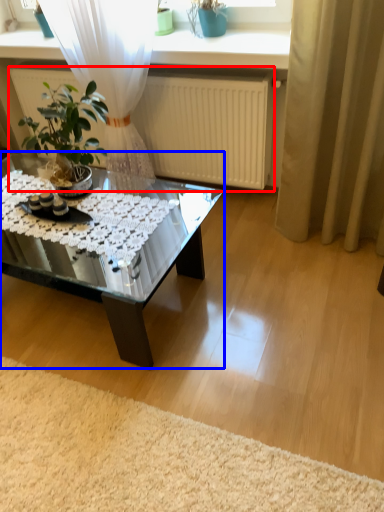
Question: Among these objects, which one is nearest to the camera, radiator (highlighted by a red box) or coffee table (highlighted by a blue box)?

Choices:
 (A) radiator
 (B) coffee table

Answer: (B)